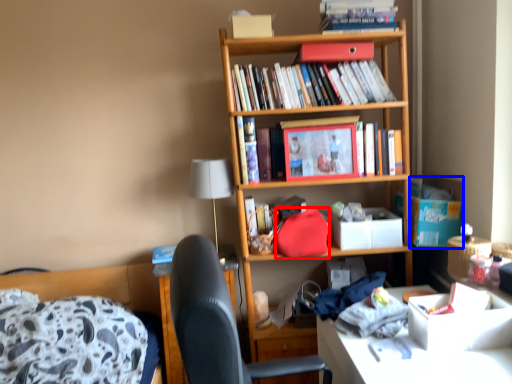
Question: Which point is further to the camera, handbag (highlighted by a red box) or cardboard box (highlighted by a blue box)?

Choices:
 (A) handbag
 (B) cardboard box

Answer: (B)